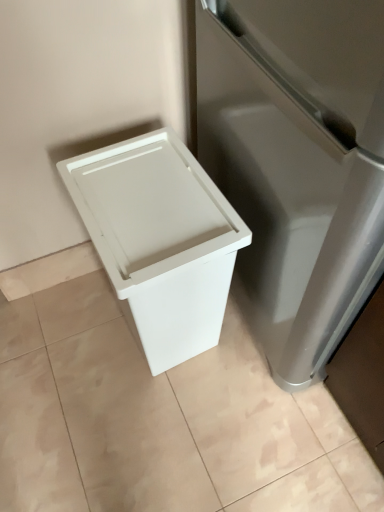
Where is `free space to the left of white plastic waste bin at lower left`? The image size is (384, 512). free space to the left of white plastic waste bin at lower left is located at coordinates [x=66, y=341].